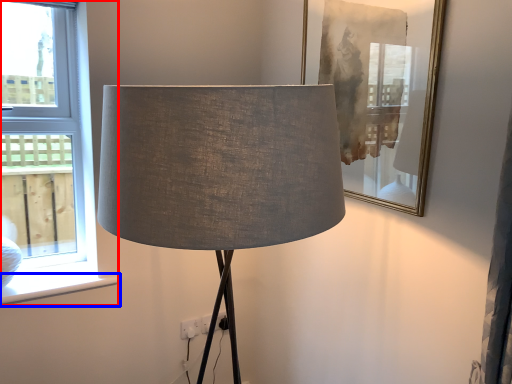
Question: Among these objects, which one is farthest to the camera, window (highlighted by a red box) or window sill (highlighted by a blue box)?

Choices:
 (A) window
 (B) window sill

Answer: (B)